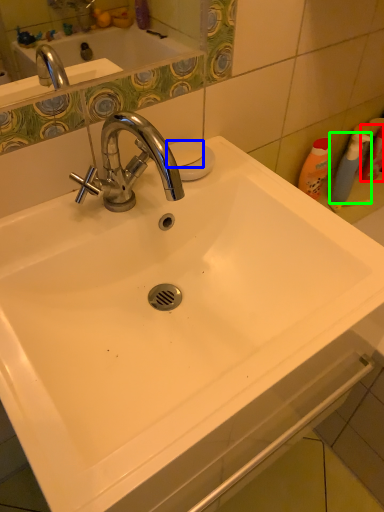
Question: Considering the real-world distances, which object is closest to cleaning product (highlighted by a red box)? soap (highlighted by a blue box) or cleaning product (highlighted by a green box).

Choices:
 (A) soap
 (B) cleaning product

Answer: (B)